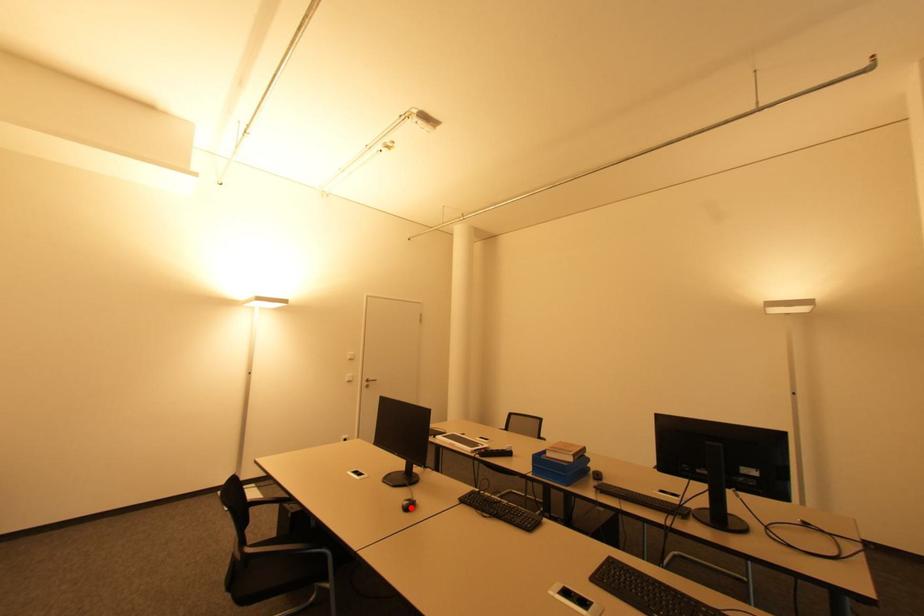
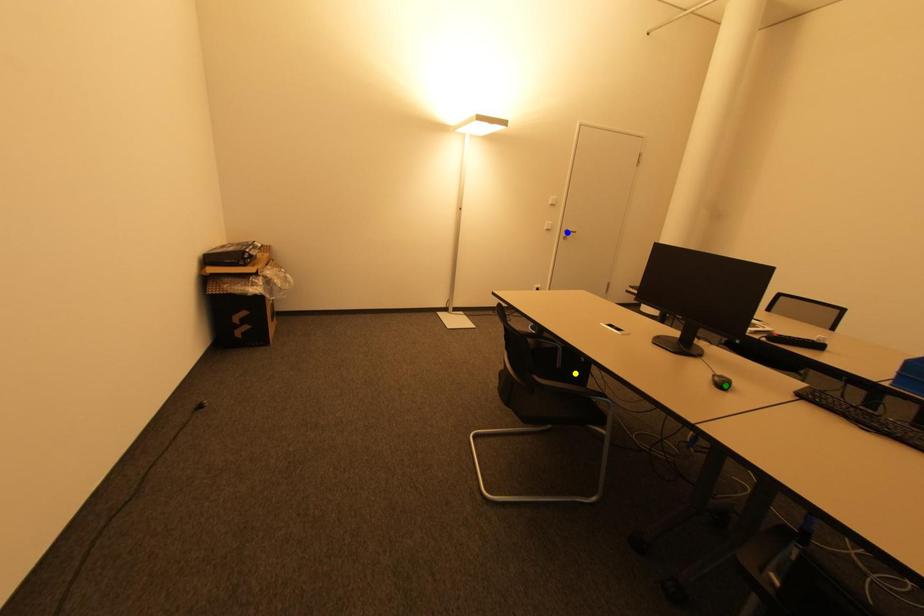
Question: I am providing you with two images of the same scene from different viewpoints. A red point is marked on the first image. You are given multiple points on the second image. Which mark in image 2 goes with the point in image 1?

Choices:
 (A) green point
 (B) yellow point
 (C) blue point

Answer: (A)